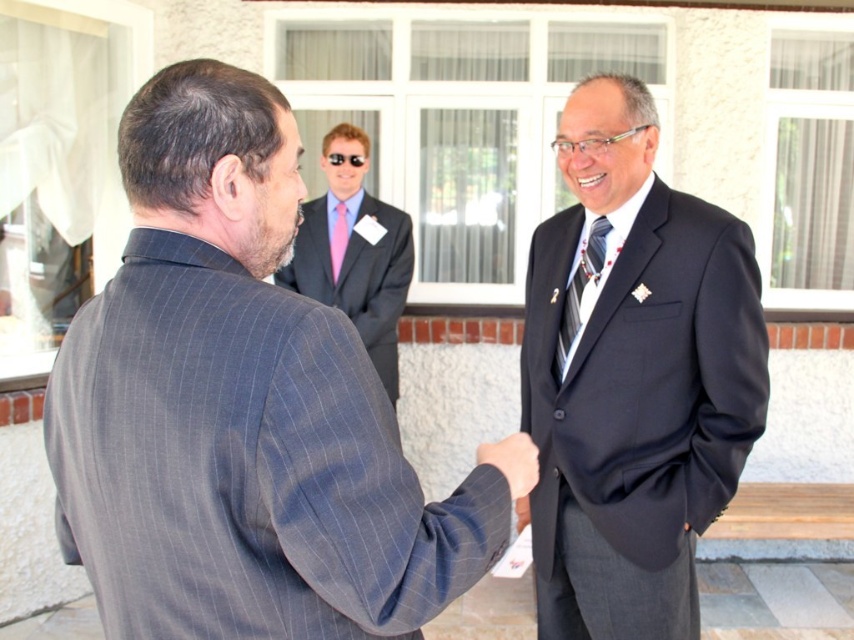
Is matte pink tie at center closer to camera compared to pink silk tie at center?

That is True.

Image resolution: width=854 pixels, height=640 pixels. What do you see at coordinates (355, 252) in the screenshot? I see `matte pink tie at center` at bounding box center [355, 252].

Is point (346, 252) in front of point (332, 259)?

Yes, it is.

Locate an element on the screen. The width and height of the screenshot is (854, 640). matte pink tie at center is located at coordinates (355, 252).

Is dark blue suit at center smaller than smooth leather hand at center?

Actually, dark blue suit at center might be larger than smooth leather hand at center.

What are the coordinates of `dark blue suit at center` in the screenshot? It's located at (632, 378).

Can you confirm if smooth leather hand at center is shorter than pink silk tie at center?

Yes.

Does smooth leather hand at center have a greater height compared to pink silk tie at center?

No.

Is point (500, 452) closer to viewer compared to point (340, 221)?

Yes.

This screenshot has height=640, width=854. In order to click on smooth leather hand at center in this screenshot , I will do `click(512, 461)`.